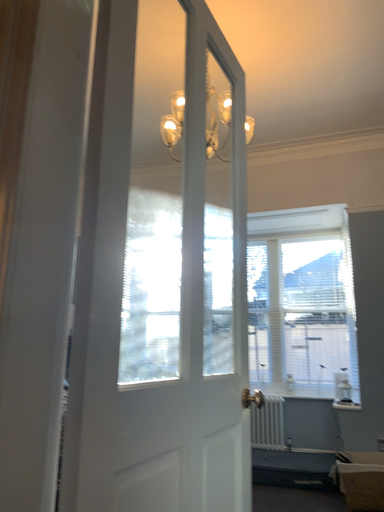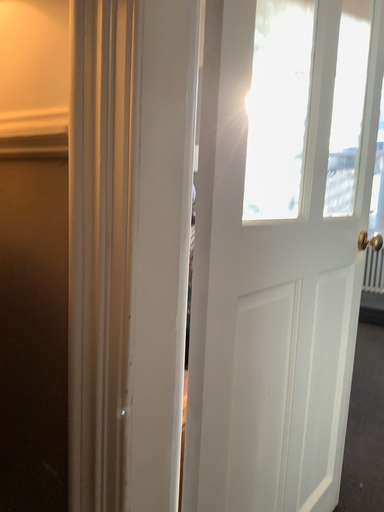
Question: Which way did the camera rotate in the video?

Choices:
 (A) rotated left
 (B) rotated right

Answer: (A)